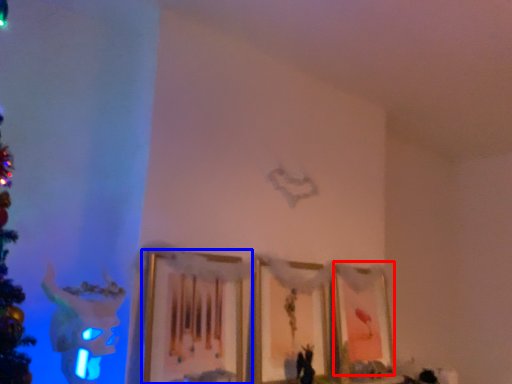
Question: Which point is further to the camera, picture frame (highlighted by a red box) or picture frame (highlighted by a blue box)?

Choices:
 (A) picture frame
 (B) picture frame

Answer: (A)